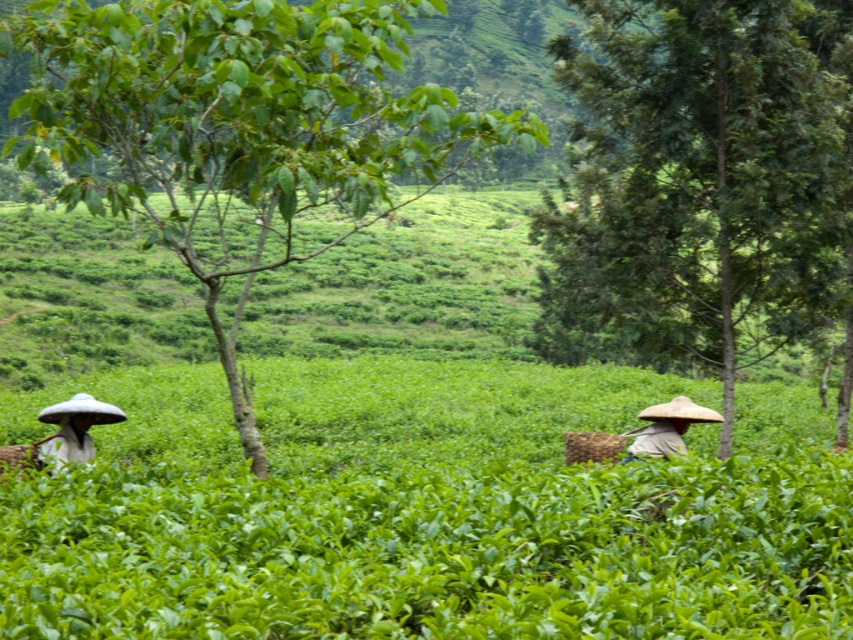
You are a photographer positioned at the edge of the tea fields. You want to take a photo that includes both the matte white hat at left and the light brown straw hat at right. Which hat will appear larger in your photo?

The matte white hat at left will appear larger in the photo because it is closer to the viewer than the light brown straw hat at right.

You are a photographer standing in the tea plantation. You want to take a photo that includes both the green leafy tree at left and the matte white hat at left. Which object will appear larger in the photo?

The green leafy tree at left will appear larger in the photo because it is closer to the photographer than the matte white hat at left.